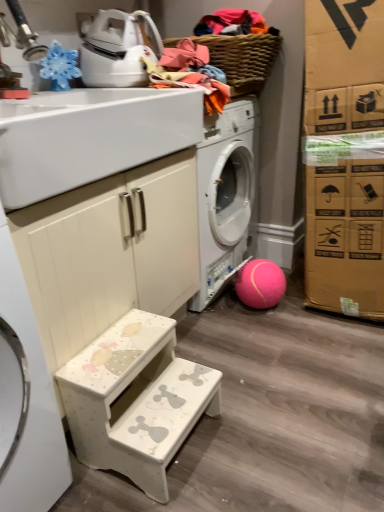
Question: Can you confirm if white painted wood cabinet at lower left is positioned to the right of white glossy sink at upper left?

Choices:
 (A) no
 (B) yes

Answer: (B)

Question: Considering the relative sizes of white painted wood cabinet at lower left and white glossy sink at upper left in the image provided, is white painted wood cabinet at lower left wider than white glossy sink at upper left?

Choices:
 (A) yes
 (B) no

Answer: (B)

Question: Is white painted wood cabinet at lower left outside white glossy sink at upper left?

Choices:
 (A) yes
 (B) no

Answer: (A)

Question: Does white painted wood cabinet at lower left turn towards white glossy sink at upper left?

Choices:
 (A) no
 (B) yes

Answer: (A)

Question: Does white painted wood cabinet at lower left come behind white glossy sink at upper left?

Choices:
 (A) no
 (B) yes

Answer: (B)

Question: From the image's perspective, would you say white painted wood cabinet at lower left is positioned over white glossy sink at upper left?

Choices:
 (A) yes
 (B) no

Answer: (B)

Question: Is woven brown basket at upper center to the left of white glossy iron at upper left from the viewer's perspective?

Choices:
 (A) no
 (B) yes

Answer: (A)

Question: Does woven brown basket at upper center lie behind white glossy iron at upper left?

Choices:
 (A) yes
 (B) no

Answer: (A)

Question: Is white glossy iron at upper left a part of woven brown basket at upper center?

Choices:
 (A) no
 (B) yes

Answer: (A)

Question: Does woven brown basket at upper center have a lesser width compared to white glossy iron at upper left?

Choices:
 (A) no
 (B) yes

Answer: (A)

Question: Is woven brown basket at upper center beside white glossy iron at upper left?

Choices:
 (A) yes
 (B) no

Answer: (B)

Question: Does woven brown basket at upper center have a larger size compared to white glossy iron at upper left?

Choices:
 (A) yes
 (B) no

Answer: (A)

Question: Can you see woven brown basket at upper center touching white glossy sink at upper left?

Choices:
 (A) yes
 (B) no

Answer: (B)